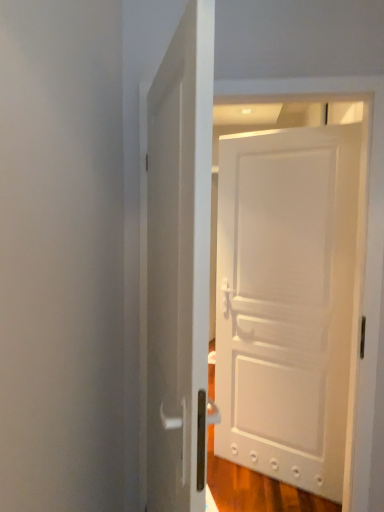
What is the approximate width of white glossy door at center, which is the 2th door in right-to-left order?

It is 7.03 inches.

The width and height of the screenshot is (384, 512). What are the coordinates of `white glossy door at center, which is the 2th door in right-to-left order` in the screenshot? It's located at [179, 264].

Describe the element at coordinates (179, 264) in the screenshot. I see `white glossy door at center, placed as the 1th door when sorted from left to right` at that location.

Find the location of `white matte door at center, the 2th door positioned from the front`. white matte door at center, the 2th door positioned from the front is located at coordinates (286, 301).

Describe the element at coordinates (286, 301) in the screenshot. Image resolution: width=384 pixels, height=512 pixels. I see `white matte door at center, which is counted as the 1th door, starting from the right` at that location.

In order to face white matte door at center, the 2th door positioned from the front, should I rotate leftwards or rightwards?

Rotate your view right by about 11.344°.

The width and height of the screenshot is (384, 512). I want to click on white glossy door at center, which is the 2th door in right-to-left order, so click(179, 264).

Which object is positioned more to the left, white matte door at center, which is counted as the 1th door, starting from the right, or white glossy door at center, placed as the 1th door when sorted from left to right?

white glossy door at center, placed as the 1th door when sorted from left to right.

Is white matte door at center, which is counted as the 1th door, starting from the right, positioned behind white glossy door at center, marked as the second door in a back-to-front arrangement?

Yes, white matte door at center, which is counted as the 1th door, starting from the right, is further from the viewer.

Which point is more distant from viewer, [291,398] or [197,45]?

Point [291,398]

Looking at this image, from the image's perspective, which is above, white matte door at center, acting as the 1th door starting from the back, or white glossy door at center, placed as the 1th door when sorted from left to right?

white glossy door at center, placed as the 1th door when sorted from left to right, appears higher in the image.

From a real-world perspective, is white matte door at center, the 2th door positioned from the front, located higher than white glossy door at center, marked as the second door in a back-to-front arrangement?

No, from a real-world perspective, white matte door at center, the 2th door positioned from the front, is not above white glossy door at center, marked as the second door in a back-to-front arrangement.

In terms of width, does white matte door at center, which is the 2th door in left-to-right order, look wider or thinner when compared to white glossy door at center, marked as the second door in a back-to-front arrangement?

white matte door at center, which is the 2th door in left-to-right order, is thinner than white glossy door at center, marked as the second door in a back-to-front arrangement.

Considering the sizes of objects white matte door at center, which is the 2th door in left-to-right order, and white glossy door at center, marked as the second door in a back-to-front arrangement, in the image provided, who is shorter, white matte door at center, which is the 2th door in left-to-right order, or white glossy door at center, marked as the second door in a back-to-front arrangement,?

With less height is white glossy door at center, marked as the second door in a back-to-front arrangement.

Does white matte door at center, which is the 2th door in left-to-right order, have a smaller size compared to white glossy door at center, which is the 2th door in right-to-left order?

Yes, white matte door at center, which is the 2th door in left-to-right order, is smaller than white glossy door at center, which is the 2th door in right-to-left order.

Can we say white matte door at center, acting as the 1th door starting from the back, lies outside white glossy door at center, which is the 2th door in right-to-left order?

Yes, white matte door at center, acting as the 1th door starting from the back, is outside of white glossy door at center, which is the 2th door in right-to-left order.

Are white matte door at center, the 2th door positioned from the front, and white glossy door at center, placed as the 1th door when sorted from left to right, located far from each other?

white matte door at center, the 2th door positioned from the front, is far away from white glossy door at center, placed as the 1th door when sorted from left to right.

Is white glossy door at center, which is the first door in front-to-back order, at the back of white matte door at center, which is counted as the 1th door, starting from the right?

That's not correct — white matte door at center, which is counted as the 1th door, starting from the right, is not looking away from white glossy door at center, which is the first door in front-to-back order.

Measure the distance between white matte door at center, which is counted as the 1th door, starting from the right, and white glossy door at center, marked as the second door in a back-to-front arrangement.

white matte door at center, which is counted as the 1th door, starting from the right, and white glossy door at center, marked as the second door in a back-to-front arrangement, are 3.73 feet apart.

Identify the location of door that is on the right side of white glossy door at center, marked as the second door in a back-to-front arrangement. (286, 301).

Considering the relative positions of white glossy door at center, which is the 2th door in right-to-left order, and white matte door at center, which is the 2th door in left-to-right order, in the image provided, is white glossy door at center, which is the 2th door in right-to-left order, to the left of white matte door at center, which is the 2th door in left-to-right order, from the viewer's perspective?

Correct, you'll find white glossy door at center, which is the 2th door in right-to-left order, to the left of white matte door at center, which is the 2th door in left-to-right order.

Which object is closer to the camera, white glossy door at center, marked as the second door in a back-to-front arrangement, or white matte door at center, acting as the 1th door starting from the back?

Positioned in front is white glossy door at center, marked as the second door in a back-to-front arrangement.

Does point (200, 244) lie in front of point (312, 185)?

Yes.

From the image's perspective, is white glossy door at center, which is the 2th door in right-to-left order, under white matte door at center, the 2th door positioned from the front?

No, from the image's perspective, white glossy door at center, which is the 2th door in right-to-left order, is not beneath white matte door at center, the 2th door positioned from the front.

From a real-world perspective, which object stands above the other?

In real-world perspective, white glossy door at center, marked as the second door in a back-to-front arrangement, is above.

Is white glossy door at center, marked as the second door in a back-to-front arrangement, wider than white matte door at center, acting as the 1th door starting from the back?

Yes, white glossy door at center, marked as the second door in a back-to-front arrangement, is wider than white matte door at center, acting as the 1th door starting from the back.

From their relative heights in the image, would you say white glossy door at center, which is the 2th door in right-to-left order, is taller or shorter than white matte door at center, acting as the 1th door starting from the back?

In the image, white glossy door at center, which is the 2th door in right-to-left order, appears to be shorter than white matte door at center, acting as the 1th door starting from the back.

Who is bigger, white glossy door at center, marked as the second door in a back-to-front arrangement, or white matte door at center, which is counted as the 1th door, starting from the right?

white glossy door at center, marked as the second door in a back-to-front arrangement, is bigger.

Is white matte door at center, the 2th door positioned from the front, a part of white glossy door at center, which is the 2th door in right-to-left order?

No, white matte door at center, the 2th door positioned from the front, is not a part of white glossy door at center, which is the 2th door in right-to-left order.

Is white glossy door at center, marked as the second door in a back-to-front arrangement, next to white matte door at center, which is counted as the 1th door, starting from the right, and touching it?

No, white glossy door at center, marked as the second door in a back-to-front arrangement, is not beside white matte door at center, which is counted as the 1th door, starting from the right.

Is white glossy door at center, marked as the second door in a back-to-front arrangement, aimed at white matte door at center, which is counted as the 1th door, starting from the right?

No, white glossy door at center, marked as the second door in a back-to-front arrangement, is not turned towards white matte door at center, which is counted as the 1th door, starting from the right.

The height and width of the screenshot is (512, 384). Identify the location of door on the right side of white glossy door at center, which is the 2th door in right-to-left order. (286, 301).

Find the location of a particular element. The width and height of the screenshot is (384, 512). door located behind the white glossy door at center, placed as the 1th door when sorted from left to right is located at coordinates (286, 301).

At what (x,y) coordinates should I click in order to perform the action: click on door that is under the white glossy door at center, placed as the 1th door when sorted from left to right (from a real-world perspective). Please return your answer as a coordinate pair (x, y). This screenshot has height=512, width=384. Looking at the image, I should click on (286, 301).